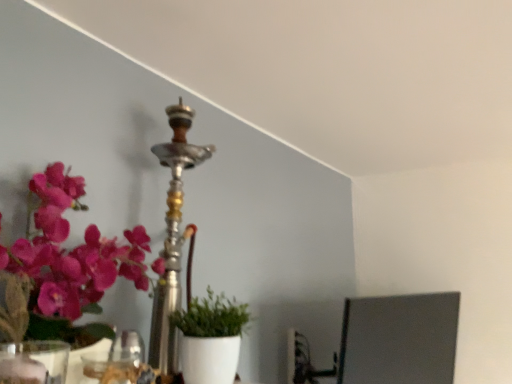
You are a GUI agent. You are given a task and a screenshot of the screen. Output one action in this format:
    pyautogui.click(x=<x>, y=<y>)
    Task: Click on the silver metallic hookah at center
    The height and width of the screenshot is (384, 512).
    Given the screenshot: What is the action you would take?
    pyautogui.click(x=173, y=238)

In the scene shown: Which of these two, metallic pink flowers at left or green matte plant at center, stands taller?

metallic pink flowers at left.

Is metallic pink flowers at left not near green matte plant at center?

No.

Based on their positions, is metallic pink flowers at left located to the left or right of green matte plant at center?

metallic pink flowers at left is positioned on green matte plant at center's left side.

Is green matte plant at center directly adjacent to silver metallic hookah at center?

No, green matte plant at center is not beside silver metallic hookah at center.

Between green matte plant at center and silver metallic hookah at center, which one has larger width?

With larger width is silver metallic hookah at center.

From the image's perspective, is green matte plant at center under silver metallic hookah at center?

Indeed, from the image's perspective, green matte plant at center is shown beneath silver metallic hookah at center.

Considering the positions of points (198, 375) and (169, 360), is point (198, 375) closer to camera compared to point (169, 360)?

Yes, point (198, 375) is closer to viewer.

I want to click on candle holder above the transparent glass vase at lower left (from the image's perspective), so 173,238.

Looking at this image, considering the relative sizes of transparent glass vase at lower left and silver metallic hookah at center in the image provided, is transparent glass vase at lower left wider than silver metallic hookah at center?

No, transparent glass vase at lower left is not wider than silver metallic hookah at center.

Considering the relative positions of green matte plant at center and metallic pink flowers at left in the image provided, is green matte plant at center behind metallic pink flowers at left?

Yes, the depth of green matte plant at center is greater than that of metallic pink flowers at left.

From the image's perspective, which one is positioned lower, green matte plant at center or metallic pink flowers at left?

green matte plant at center is shown below in the image.

Considering the positions of point (205, 373) and point (49, 307), is point (205, 373) closer or farther from the camera than point (49, 307)?

Point (205, 373) is farther from the camera than point (49, 307).

From a real-world perspective, who is located lower, green matte plant at center or metallic pink flowers at left?

green matte plant at center, from a real-world perspective.

Would you say transparent glass vase at lower left contains metallic pink flowers at left?

Actually, metallic pink flowers at left is outside transparent glass vase at lower left.

From a real-world perspective, is transparent glass vase at lower left on metallic pink flowers at left?

Incorrect, from a real-world perspective, transparent glass vase at lower left is lower than metallic pink flowers at left.

Is the surface of transparent glass vase at lower left in direct contact with metallic pink flowers at left?

transparent glass vase at lower left and metallic pink flowers at left are clearly separated.

Considering the positions of point (170, 366) and point (22, 348), is point (170, 366) closer or farther from the camera than point (22, 348)?

Point (170, 366) is farther from the camera than point (22, 348).

From the image's perspective, is silver metallic hookah at center above or below transparent glass vase at lower left?

From the image's perspective, silver metallic hookah at center appears above transparent glass vase at lower left.

From a real-world perspective, who is located lower, silver metallic hookah at center or transparent glass vase at lower left?

transparent glass vase at lower left is physically lower.

Which object is closer to the camera taking this photo, green matte plant at center or transparent glass vase at lower left?

transparent glass vase at lower left.

Is transparent glass vase at lower left at the back of green matte plant at center?

No, green matte plant at center's orientation is not away from transparent glass vase at lower left.

Considering the sizes of green matte plant at center and transparent glass vase at lower left in the image, is green matte plant at center wider or thinner than transparent glass vase at lower left?

Clearly, green matte plant at center has more width compared to transparent glass vase at lower left.

Who is bigger, green matte plant at center or transparent glass vase at lower left?

green matte plant at center is bigger.

Locate an element on the screen. This screenshot has height=384, width=512. flower located above the green matte plant at center (from a real-world perspective) is located at coordinates (71, 251).

You are a GUI agent. You are given a task and a screenshot of the screen. Output one action in this format:
    pyautogui.click(x=<x>, y=<y>)
    Task: Click on the houseplant that appears in front of the silver metallic hookah at center
    This screenshot has height=384, width=512.
    Given the screenshot: What is the action you would take?
    pyautogui.click(x=211, y=338)

Based on their spatial positions, is green matte plant at center or transparent glass vase at lower left further from silver metallic hookah at center?

transparent glass vase at lower left lies further to silver metallic hookah at center than the other object.

Which object lies further to the anchor point green matte plant at center, silver metallic hookah at center or transparent glass vase at lower left?

transparent glass vase at lower left is positioned further to the anchor green matte plant at center.

From the image, which object appears to be nearer to green matte plant at center, transparent glass vase at lower left or silver metallic hookah at center?

silver metallic hookah at center is closer to green matte plant at center.

Estimate the real-world distances between objects in this image. Which object is further from silver metallic hookah at center, transparent glass vase at lower left or metallic pink flowers at left?

transparent glass vase at lower left.

Which object lies nearer to the anchor point silver metallic hookah at center, green matte plant at center or metallic pink flowers at left?

Among the two, green matte plant at center is located nearer to silver metallic hookah at center.

Based on their spatial positions, is green matte plant at center or silver metallic hookah at center closer to metallic pink flowers at left?

silver metallic hookah at center is closer to metallic pink flowers at left.

Consider the image. From the image, which object appears to be farther from metallic pink flowers at left, transparent glass vase at lower left or silver metallic hookah at center?

silver metallic hookah at center lies further to metallic pink flowers at left than the other object.

Which object lies further to the anchor point transparent glass vase at lower left, metallic pink flowers at left or silver metallic hookah at center?

Based on the image, silver metallic hookah at center appears to be further to transparent glass vase at lower left.

The width and height of the screenshot is (512, 384). I want to click on houseplant located between metallic pink flowers at left and silver metallic hookah at center in the depth direction, so click(211, 338).

Identify the location of flower between transparent glass vase at lower left and green matte plant at center along the z-axis. (71, 251).

Identify the location of houseplant located between transparent glass vase at lower left and silver metallic hookah at center in the depth direction. This screenshot has width=512, height=384. click(x=211, y=338).

Locate an element on the screen. This screenshot has height=384, width=512. flower between transparent glass vase at lower left and silver metallic hookah at center along the z-axis is located at coordinates (71, 251).